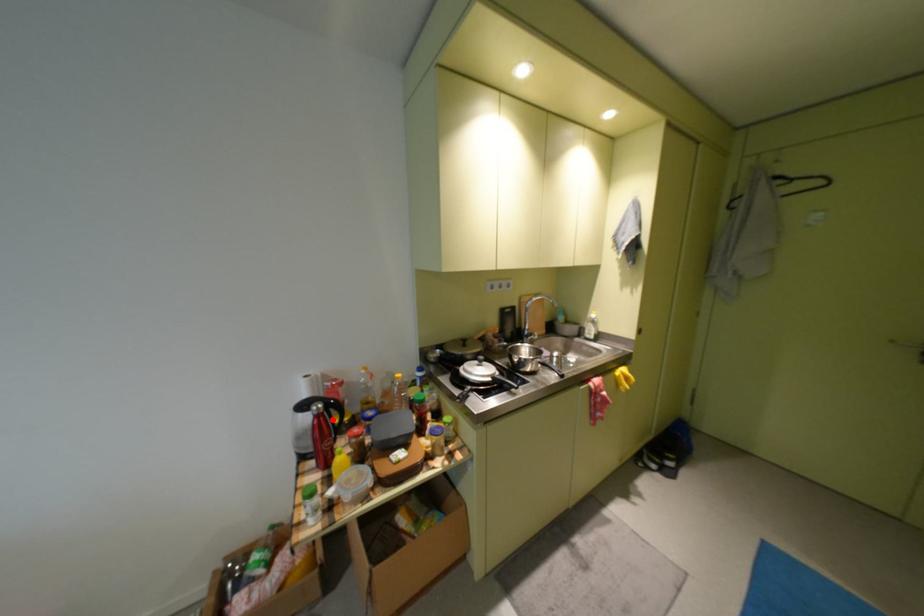
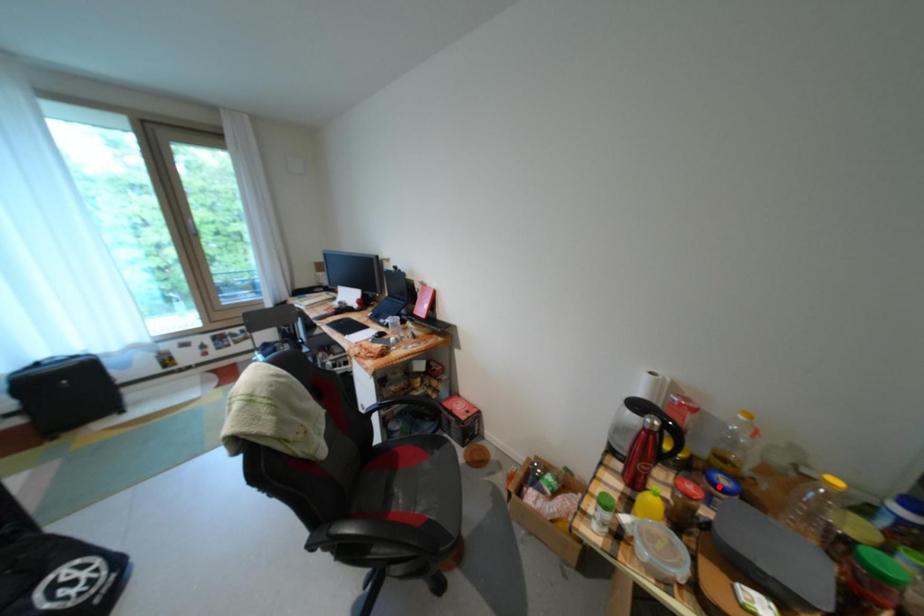
I am providing you with two images of the same scene from different viewpoints. A red point is marked on the first image and another point is marked on the second image. Is the red point in image1 aligned with the point shown in image2?

No